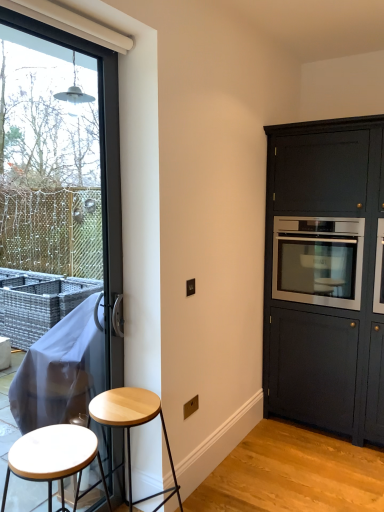
Question: Does white matte stool at lower left, which appears as the first stool when viewed from the front, lie behind light wood stool at lower left, which is counted as the 2th stool, starting from the front?

Choices:
 (A) yes
 (B) no

Answer: (B)

Question: Would you say white matte stool at lower left, arranged as the 2th stool when viewed from the back, contains light wood stool at lower left, which is counted as the 2th stool, starting from the front?

Choices:
 (A) yes
 (B) no

Answer: (B)

Question: Does white matte stool at lower left, arranged as the 2th stool when viewed from the back, come in front of light wood stool at lower left, the first stool in the back-to-front sequence?

Choices:
 (A) no
 (B) yes

Answer: (B)

Question: Does white matte stool at lower left, which appears as the first stool when viewed from the front, have a lesser height compared to light wood stool at lower left, the first stool in the back-to-front sequence?

Choices:
 (A) yes
 (B) no

Answer: (A)

Question: From a real-world perspective, is white matte stool at lower left, arranged as the 2th stool when viewed from the back, positioned under light wood stool at lower left, the first stool in the back-to-front sequence, based on gravity?

Choices:
 (A) yes
 (B) no

Answer: (B)

Question: Is white matte stool at lower left, arranged as the 2th stool when viewed from the back, smaller than light wood stool at lower left, the first stool in the back-to-front sequence?

Choices:
 (A) no
 (B) yes

Answer: (B)

Question: Is matte dark wood cabinet at right at the right side of stainless steel oven at right?

Choices:
 (A) no
 (B) yes

Answer: (B)

Question: From a real-world perspective, is matte dark wood cabinet at right positioned over stainless steel oven at right based on gravity?

Choices:
 (A) yes
 (B) no

Answer: (B)

Question: Does matte dark wood cabinet at right have a larger size compared to stainless steel oven at right?

Choices:
 (A) yes
 (B) no

Answer: (A)

Question: Can you confirm if matte dark wood cabinet at right is shorter than stainless steel oven at right?

Choices:
 (A) yes
 (B) no

Answer: (B)

Question: From the image's perspective, would you say matte dark wood cabinet at right is shown under stainless steel oven at right?

Choices:
 (A) no
 (B) yes

Answer: (B)

Question: From a real-world perspective, does matte dark wood cabinet at right sit lower than stainless steel oven at right?

Choices:
 (A) no
 (B) yes

Answer: (B)

Question: Is matte dark wood cabinet at right at the right side of light wood stool at lower left, the first stool in the back-to-front sequence?

Choices:
 (A) yes
 (B) no

Answer: (A)